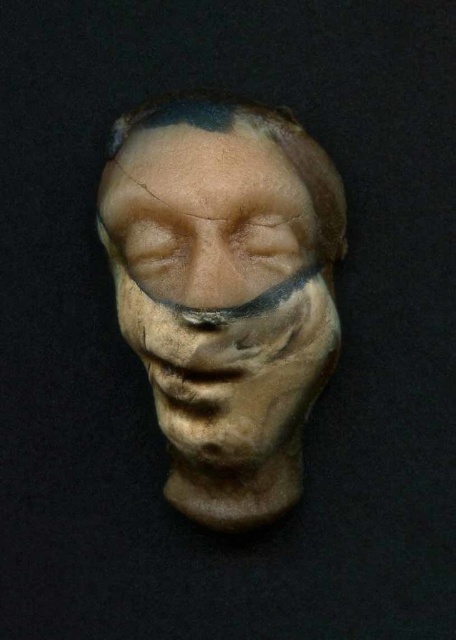
Between matte clay face at center and brown matte eyebrow at upper center, which one appears on the left side from the viewer's perspective?

From the viewer's perspective, brown matte eyebrow at upper center appears more on the left side.

Between point (343, 236) and point (129, 132), which one is positioned behind?

The point (343, 236) is more distant.

What do you see at coordinates (222, 266) in the screenshot?
I see `matte clay face at center` at bounding box center [222, 266].

The height and width of the screenshot is (640, 456). Find the location of `matte clay face at center`. matte clay face at center is located at coordinates (222, 266).

Is brown matte eyebrow at upper center to the right of matte brown eye at center from the viewer's perspective?

In fact, brown matte eyebrow at upper center is to the left of matte brown eye at center.

Does brown matte eyebrow at upper center appear under matte brown eye at center?

Actually, brown matte eyebrow at upper center is above matte brown eye at center.

Which is behind, point (192, 109) or point (285, 216)?

The point (285, 216) is more distant.

This screenshot has width=456, height=640. Find the location of `brown matte eyebrow at upper center`. brown matte eyebrow at upper center is located at coordinates (184, 113).

Locate an element on the screen. The height and width of the screenshot is (640, 456). matte clay face at center is located at coordinates (222, 266).

Does matte clay face at center appear on the right side of matte brown eye at center?

In fact, matte clay face at center is to the left of matte brown eye at center.

Which is in front, point (299, 180) or point (291, 220)?

Point (299, 180)

The height and width of the screenshot is (640, 456). Find the location of `matte clay face at center`. matte clay face at center is located at coordinates (222, 266).